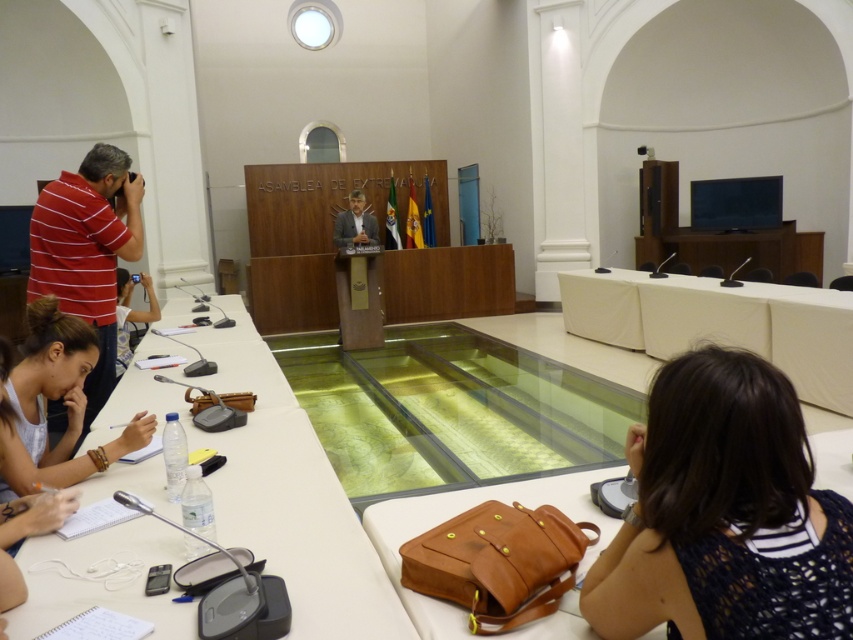
Question: Does white leather notebook at lower left have a greater width compared to light brown leather jacket at center?

Choices:
 (A) no
 (B) yes

Answer: (B)

Question: Can you confirm if white fabric table at center is positioned below light brown leather jacket at center?

Choices:
 (A) no
 (B) yes

Answer: (B)

Question: Based on their relative distances, which object is nearer to the brown leather bag at lower center?

Choices:
 (A) matte black camera at left
 (B) light brown leather jacket at center
 (C) white leather notebook at lower left

Answer: (C)

Question: Does dark blue knitted sweater at lower right appear over matte black camera at left?

Choices:
 (A) no
 (B) yes

Answer: (A)

Question: Based on their relative distances, which object is nearer to the white leather notebook at lower left?

Choices:
 (A) striped cotton shirt at left
 (B) dark blue knitted sweater at lower right

Answer: (A)

Question: Which point is farther to the camera?

Choices:
 (A) light brown leather jacket at center
 (B) brown leather bag at lower center

Answer: (A)